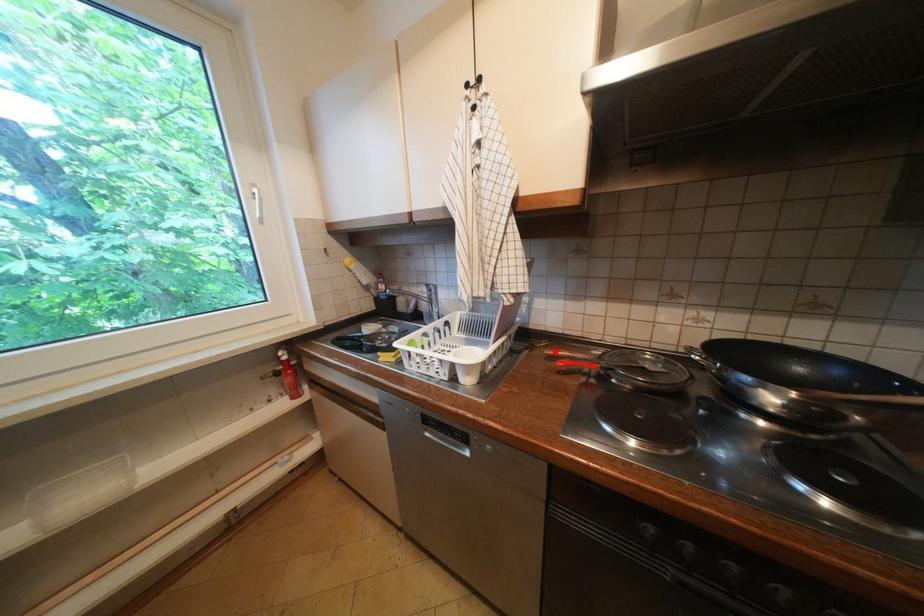
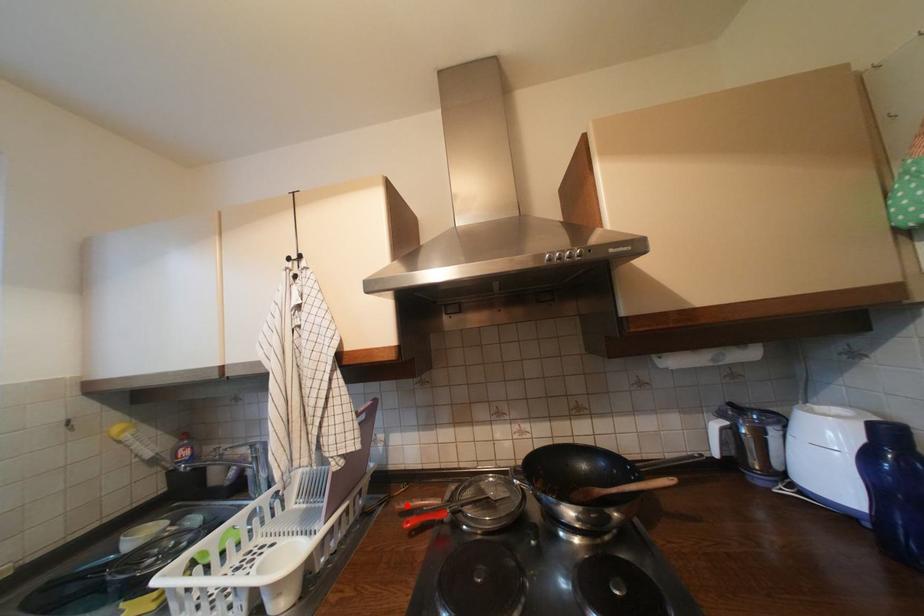
I am providing you with two images of the same scene from different viewpoints. A red point is marked on the first image and another point is marked on the second image. Is the marked point in image1 the same physical position as the marked point in image2?

Yes